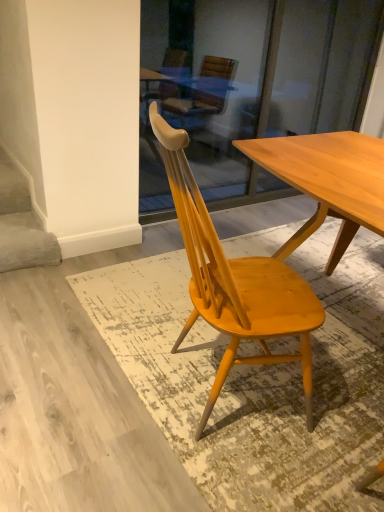
Question: Is light brown wood chair at center touching white matte stairwell at lower left?

Choices:
 (A) no
 (B) yes

Answer: (A)

Question: Is light brown wood chair at center taller than white matte stairwell at lower left?

Choices:
 (A) yes
 (B) no

Answer: (A)

Question: Does light brown wood chair at center have a larger size compared to white matte stairwell at lower left?

Choices:
 (A) yes
 (B) no

Answer: (A)

Question: From a real-world perspective, is light brown wood chair at center below white matte stairwell at lower left?

Choices:
 (A) no
 (B) yes

Answer: (A)

Question: Is white matte stairwell at lower left at the back of light brown wood chair at center?

Choices:
 (A) yes
 (B) no

Answer: (B)

Question: Considering the relative sizes of light brown wood chair at center and white matte stairwell at lower left in the image provided, is light brown wood chair at center shorter than white matte stairwell at lower left?

Choices:
 (A) yes
 (B) no

Answer: (B)

Question: Can we say white matte stairwell at lower left lies outside light brown wood chair at center?

Choices:
 (A) yes
 (B) no

Answer: (A)

Question: Considering the relative sizes of white matte stairwell at lower left and light brown wood chair at center in the image provided, is white matte stairwell at lower left thinner than light brown wood chair at center?

Choices:
 (A) no
 (B) yes

Answer: (B)

Question: From a real-world perspective, is white matte stairwell at lower left located higher than light brown wood chair at center?

Choices:
 (A) yes
 (B) no

Answer: (B)

Question: From a real-world perspective, is white matte stairwell at lower left positioned under light brown wood chair at center based on gravity?

Choices:
 (A) yes
 (B) no

Answer: (A)

Question: Considering the relative positions of white matte stairwell at lower left and light brown wood chair at center in the image provided, is white matte stairwell at lower left in front of light brown wood chair at center?

Choices:
 (A) no
 (B) yes

Answer: (A)

Question: Can you confirm if white matte stairwell at lower left is smaller than light brown wood chair at center?

Choices:
 (A) no
 (B) yes

Answer: (B)

Question: From the image's perspective, is white matte stairwell at lower left positioned above or below light brown wood chair at center?

Choices:
 (A) above
 (B) below

Answer: (A)